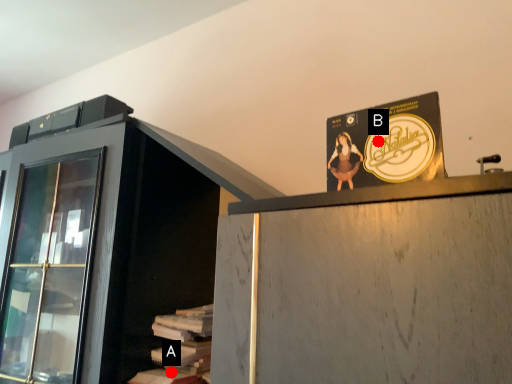
Question: Two points are circled on the image, labeled by A and B beside each circle. Which point appears closest to the camera in this image?

Choices:
 (A) A is closer
 (B) B is closer

Answer: (B)